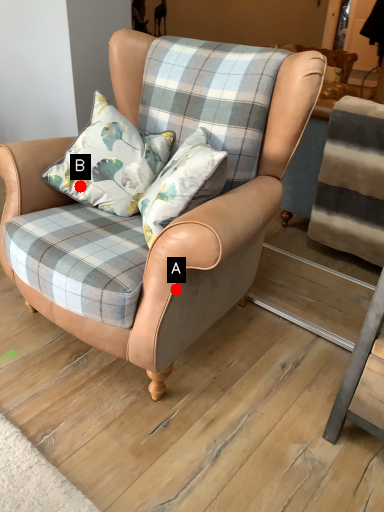
Question: Two points are circled on the image, labeled by A and B beside each circle. Among these points, which one is farthest from the camera?

Choices:
 (A) A is further
 (B) B is further

Answer: (B)